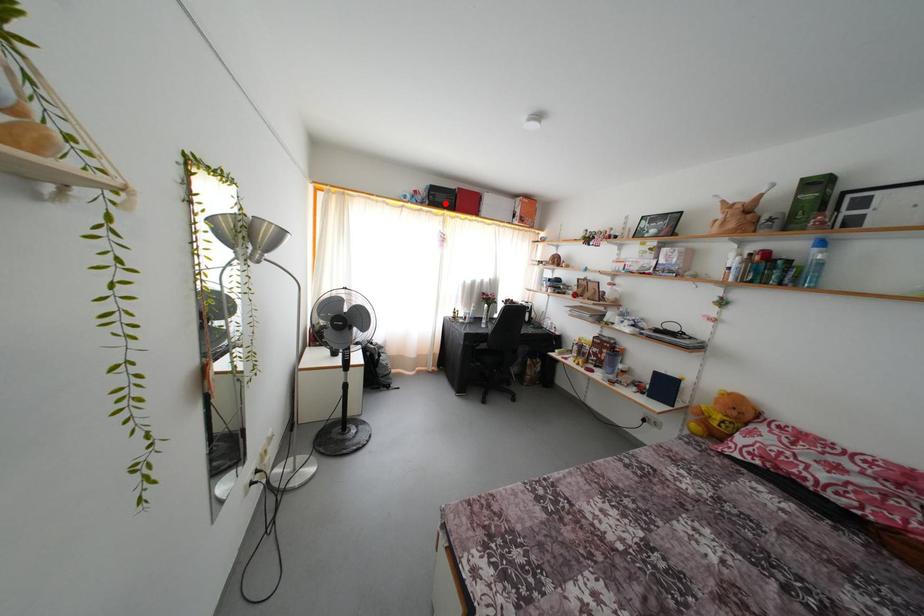
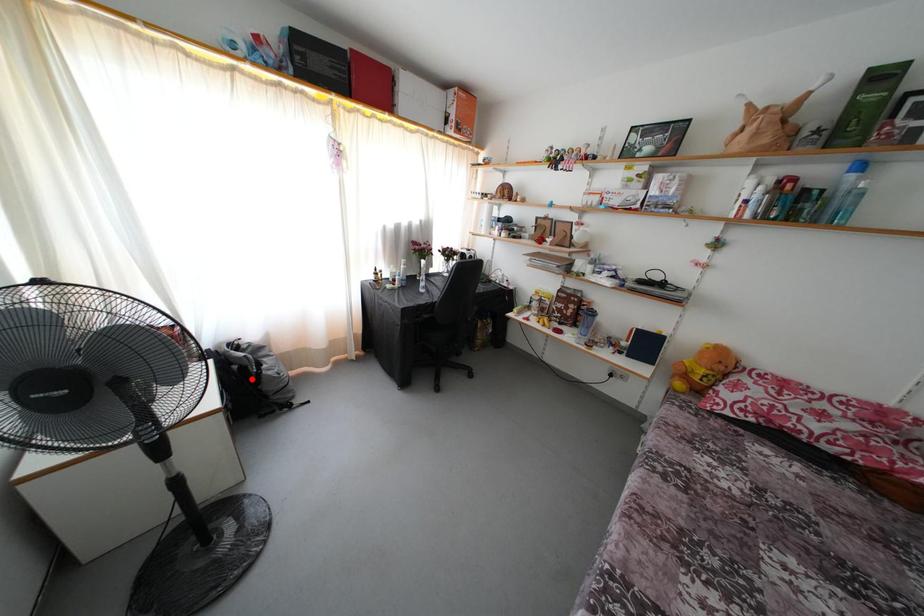
I am providing you with two images of the same scene from different viewpoints. A red point is marked on the first image and another point is marked on the second image. Are the points marked in image1 and image2 representing the same 3D position?

No